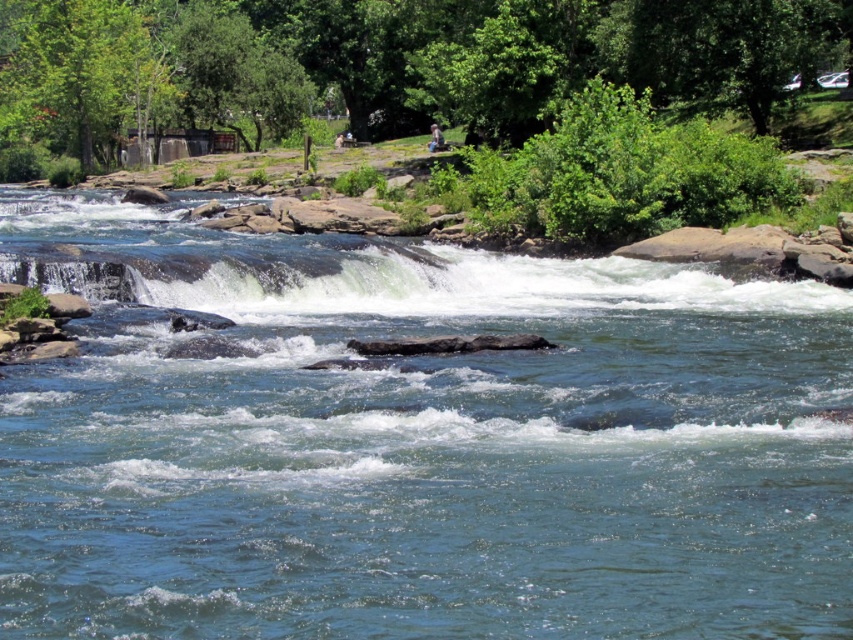
Does clear blue water at center appear under green leafy tree at upper center?

Yes.

Can you confirm if clear blue water at center is positioned to the left of green leafy tree at upper center?

In fact, clear blue water at center is to the right of green leafy tree at upper center.

The height and width of the screenshot is (640, 853). Describe the element at coordinates (416, 442) in the screenshot. I see `clear blue water at center` at that location.

Find the location of `clear blue water at center`. clear blue water at center is located at coordinates (416, 442).